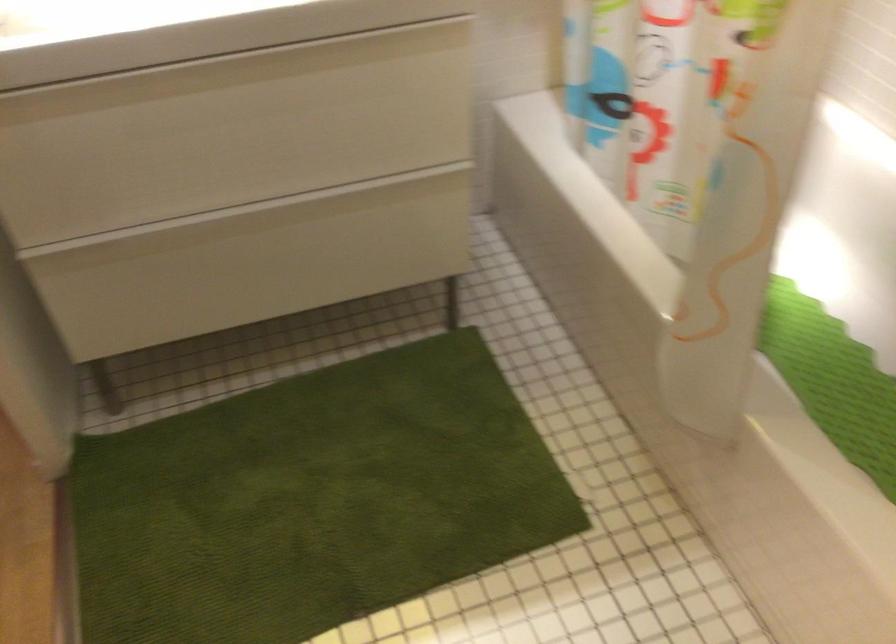
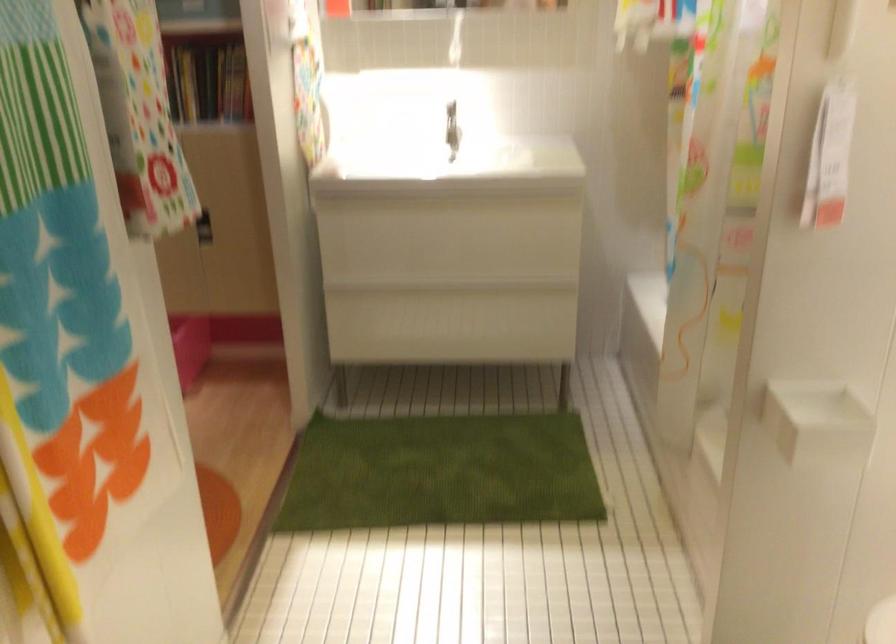
Where in the second image is the point corresponding to (210,71) from the first image?

(440, 201)